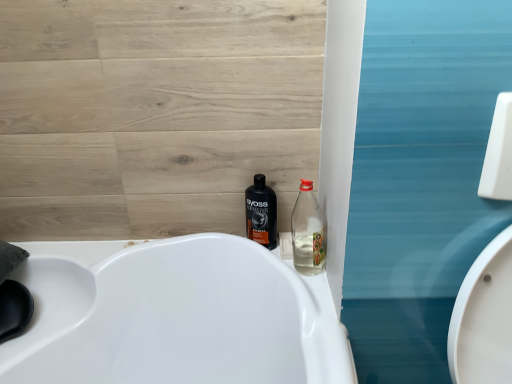
The image size is (512, 384). Identify the location of shiny black bottle at center, which is the first bottle from left to right. (261, 213).

This screenshot has height=384, width=512. Describe the element at coordinates (261, 213) in the screenshot. I see `shiny black bottle at center, which is counted as the 2th bottle, starting from the right` at that location.

You are a GUI agent. You are given a task and a screenshot of the screen. Output one action in this format:
    pyautogui.click(x=<x>, y=<y>)
    Task: Click on the clear plastic bottle at center-right, arranged as the first bottle when viewed from the right
    
    Given the screenshot: What is the action you would take?
    pyautogui.click(x=307, y=232)

Describe the element at coordinates (307, 232) in the screenshot. This screenshot has width=512, height=384. I see `clear plastic bottle at center-right, the 2th bottle in the left-to-right sequence` at that location.

This screenshot has width=512, height=384. Identify the location of shiny black bottle at center, the first bottle in the back-to-front sequence. [x=261, y=213].

Which is more to the left, shiny black bottle at center, the second bottle positioned from the front, or clear plastic bottle at center-right, placed as the 1th bottle when sorted from front to back?

Positioned to the left is shiny black bottle at center, the second bottle positioned from the front.

Between shiny black bottle at center, the second bottle positioned from the front, and clear plastic bottle at center-right, the 2th bottle in the left-to-right sequence, which one is positioned in front?

Positioned in front is clear plastic bottle at center-right, the 2th bottle in the left-to-right sequence.

Which point is more forward, (x=270, y=224) or (x=301, y=189)?

The point (x=270, y=224) is closer.

From the image's perspective, between shiny black bottle at center, the first bottle in the back-to-front sequence, and clear plastic bottle at center-right, arranged as the first bottle when viewed from the right, who is located below?

clear plastic bottle at center-right, arranged as the first bottle when viewed from the right, from the image's perspective.

From a real-world perspective, relative to clear plastic bottle at center-right, the 2th bottle in the left-to-right sequence, is shiny black bottle at center, the first bottle in the back-to-front sequence, vertically above or below?

shiny black bottle at center, the first bottle in the back-to-front sequence, is situated lower than clear plastic bottle at center-right, the 2th bottle in the left-to-right sequence, in the real world.

Is shiny black bottle at center, which is counted as the 2th bottle, starting from the right, wider than clear plastic bottle at center-right, arranged as the first bottle when viewed from the right?

Yes.

Can you confirm if shiny black bottle at center, the first bottle in the back-to-front sequence, is taller than clear plastic bottle at center-right, arranged as the first bottle when viewed from the right?

Correct, shiny black bottle at center, the first bottle in the back-to-front sequence, is much taller as clear plastic bottle at center-right, arranged as the first bottle when viewed from the right.

Is shiny black bottle at center, which is counted as the 2th bottle, starting from the right, bigger than clear plastic bottle at center-right, arranged as the first bottle when viewed from the right?

No, shiny black bottle at center, which is counted as the 2th bottle, starting from the right, is not bigger than clear plastic bottle at center-right, arranged as the first bottle when viewed from the right.

Is shiny black bottle at center, the first bottle in the back-to-front sequence, situated inside clear plastic bottle at center-right, placed as the 1th bottle when sorted from front to back, or outside?

shiny black bottle at center, the first bottle in the back-to-front sequence, is spatially situated outside clear plastic bottle at center-right, placed as the 1th bottle when sorted from front to back.

Is shiny black bottle at center, the first bottle in the back-to-front sequence, next to clear plastic bottle at center-right, placed as the 1th bottle when sorted from front to back, and touching it?

They are not placed beside each other.

Is shiny black bottle at center, the second bottle positioned from the front, turned away from clear plastic bottle at center-right, the second bottle when ordered from back to front?

shiny black bottle at center, the second bottle positioned from the front, is not turned away from clear plastic bottle at center-right, the second bottle when ordered from back to front.

What's the angular difference between shiny black bottle at center, which is counted as the 2th bottle, starting from the right, and clear plastic bottle at center-right, the second bottle when ordered from back to front,'s facing directions?

0.000374 degrees.

In order to click on bottle above the shiny black bottle at center, which is counted as the 2th bottle, starting from the right (from a real-world perspective) in this screenshot , I will do `click(307, 232)`.

Does clear plastic bottle at center-right, the 2th bottle in the left-to-right sequence, appear on the right side of shiny black bottle at center, which is the first bottle from left to right?

Correct, you'll find clear plastic bottle at center-right, the 2th bottle in the left-to-right sequence, to the right of shiny black bottle at center, which is the first bottle from left to right.

Considering the positions of objects clear plastic bottle at center-right, the 2th bottle in the left-to-right sequence, and shiny black bottle at center, which is the first bottle from left to right, in the image provided, who is behind, clear plastic bottle at center-right, the 2th bottle in the left-to-right sequence, or shiny black bottle at center, which is the first bottle from left to right,?

shiny black bottle at center, which is the first bottle from left to right.

Between point (298, 254) and point (267, 216), which one is positioned behind?

Point (298, 254)

From the image's perspective, which one is positioned lower, clear plastic bottle at center-right, the second bottle when ordered from back to front, or shiny black bottle at center, the first bottle in the back-to-front sequence?

From the image's view, clear plastic bottle at center-right, the second bottle when ordered from back to front, is below.

From a real-world perspective, is clear plastic bottle at center-right, arranged as the first bottle when viewed from the right, located higher than shiny black bottle at center, the first bottle in the back-to-front sequence?

Indeed, from a real-world perspective, clear plastic bottle at center-right, arranged as the first bottle when viewed from the right, stands above shiny black bottle at center, the first bottle in the back-to-front sequence.

From the picture: Considering the sizes of clear plastic bottle at center-right, the 2th bottle in the left-to-right sequence, and shiny black bottle at center, which is the first bottle from left to right, in the image, is clear plastic bottle at center-right, the 2th bottle in the left-to-right sequence, wider or thinner than shiny black bottle at center, which is the first bottle from left to right,?

Clearly, clear plastic bottle at center-right, the 2th bottle in the left-to-right sequence, has less width compared to shiny black bottle at center, which is the first bottle from left to right.

Who is taller, clear plastic bottle at center-right, the second bottle when ordered from back to front, or shiny black bottle at center, the second bottle positioned from the front?

With more height is shiny black bottle at center, the second bottle positioned from the front.

Considering the sizes of clear plastic bottle at center-right, placed as the 1th bottle when sorted from front to back, and shiny black bottle at center, the first bottle in the back-to-front sequence, in the image, is clear plastic bottle at center-right, placed as the 1th bottle when sorted from front to back, bigger or smaller than shiny black bottle at center, the first bottle in the back-to-front sequence,?

Considering their sizes, clear plastic bottle at center-right, placed as the 1th bottle when sorted from front to back, takes up more space than shiny black bottle at center, the first bottle in the back-to-front sequence.

Would you say clear plastic bottle at center-right, the second bottle when ordered from back to front, is inside or outside shiny black bottle at center, the second bottle positioned from the front?

clear plastic bottle at center-right, the second bottle when ordered from back to front, lies outside shiny black bottle at center, the second bottle positioned from the front.

Is clear plastic bottle at center-right, the 2th bottle in the left-to-right sequence, far away from shiny black bottle at center, the first bottle in the back-to-front sequence?

No, clear plastic bottle at center-right, the 2th bottle in the left-to-right sequence, is not far from shiny black bottle at center, the first bottle in the back-to-front sequence.

Does clear plastic bottle at center-right, the 2th bottle in the left-to-right sequence, turn towards shiny black bottle at center, which is the first bottle from left to right?

No, clear plastic bottle at center-right, the 2th bottle in the left-to-right sequence, is not aimed at shiny black bottle at center, which is the first bottle from left to right.

Can you tell me how much clear plastic bottle at center-right, placed as the 1th bottle when sorted from front to back, and shiny black bottle at center, the first bottle in the back-to-front sequence, differ in facing direction?

clear plastic bottle at center-right, placed as the 1th bottle when sorted from front to back, and shiny black bottle at center, the first bottle in the back-to-front sequence, are facing 0.000374 degrees away from each other.

Locate an element on the screen. This screenshot has width=512, height=384. bottle on the left of clear plastic bottle at center-right, the second bottle when ordered from back to front is located at coordinates (261, 213).

You are a GUI agent. You are given a task and a screenshot of the screen. Output one action in this format:
    pyautogui.click(x=<x>, y=<y>)
    Task: Click on the bottle that is on the right side of shiny black bottle at center, the second bottle positioned from the front
    The image size is (512, 384).
    Given the screenshot: What is the action you would take?
    pyautogui.click(x=307, y=232)

The image size is (512, 384). Identify the location of bottle above the clear plastic bottle at center-right, the 2th bottle in the left-to-right sequence (from the image's perspective). (261, 213).